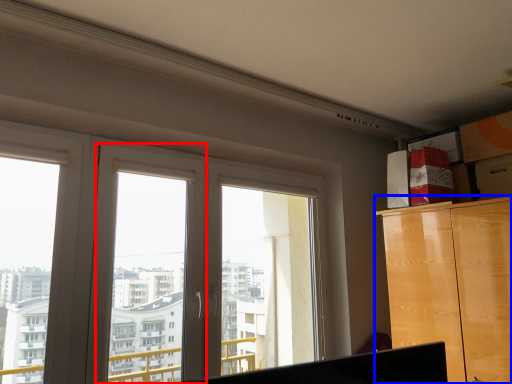
Question: Among these objects, which one is farthest to the camera, window frame (highlighted by a red box) or cabinetry (highlighted by a blue box)?

Choices:
 (A) window frame
 (B) cabinetry

Answer: (B)